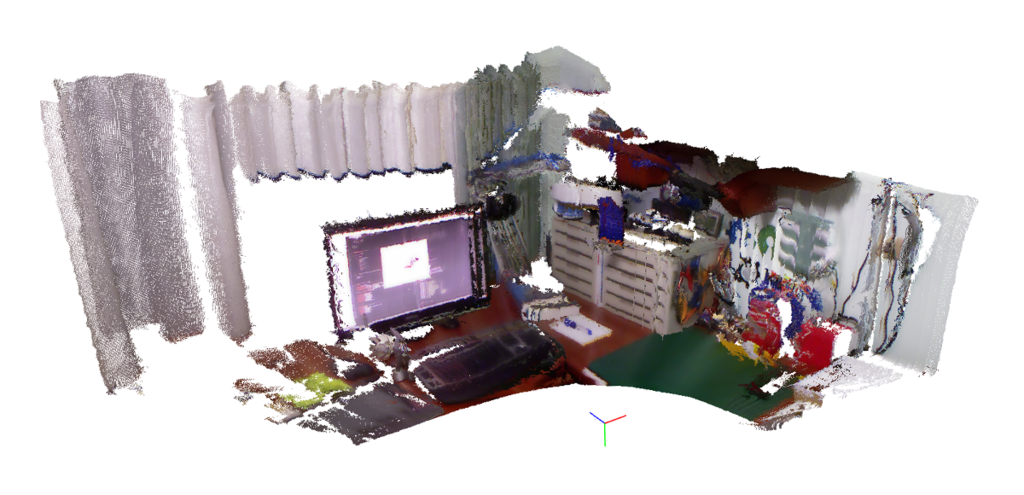
Identify the location of illustrated objects on file cabinet. (690, 192), (650, 238), (597, 207), (567, 182).